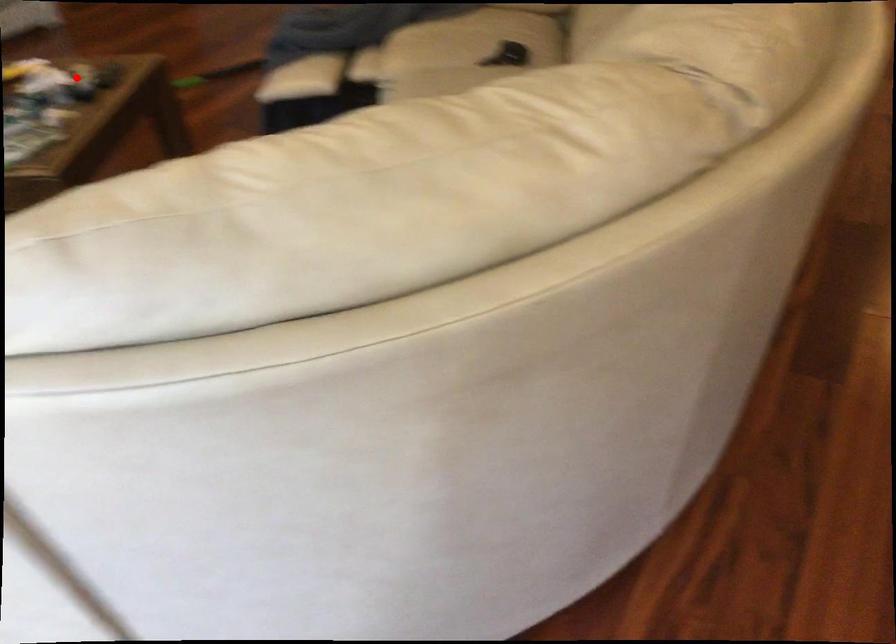
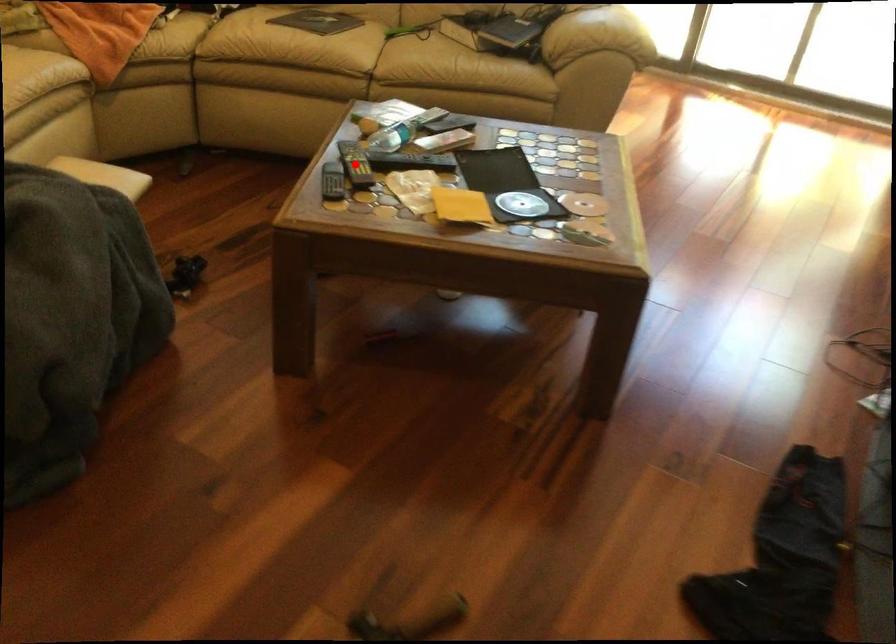
I am providing you with two images of the same scene from different viewpoints. A red point is marked on the first image and another point is marked on the second image. Do the highlighted points in image1 and image2 indicate the same real-world spot?

Yes